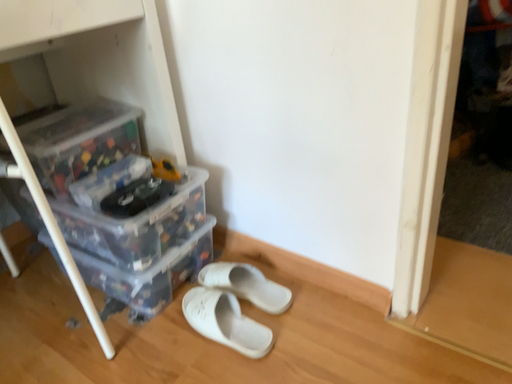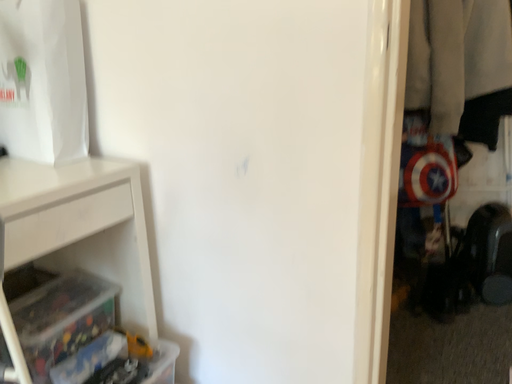
Question: How did the camera likely rotate when shooting the video?

Choices:
 (A) rotated downward
 (B) rotated upward

Answer: (B)